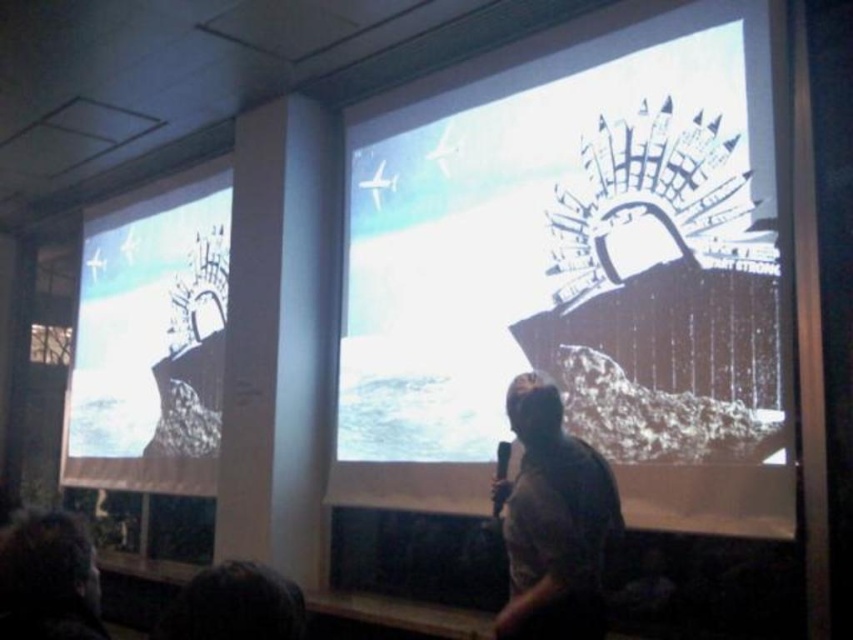
From the picture: Please describe the object located at point (577,272) in the image.

The object at point (577,272) is the white matte ship at center.

You are attending a presentation where the speaker is standing in front of two large screens. You notice the matte black ship at left and the gray fabric shirt at center. Based on their sizes, which object would appear closer to you?

The matte black ship at left appears larger in size compared to the gray fabric shirt at center, so it would likely be closer to you since larger objects typically appear bigger when nearer.

You are attending a presentation and notice two elements in the scene. The first is the matte black ship at left, and the second is the gray fabric shirt at center. Which of these two items is located to the left of the other?

The matte black ship at left is positioned on the left side of the gray fabric shirt at center.